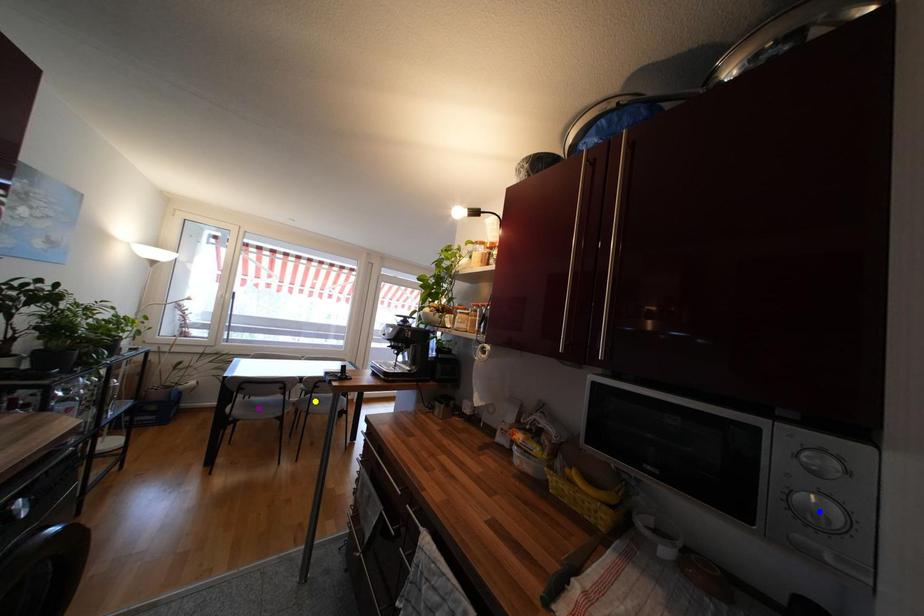
Order these from nearest to farthest:
A) purple point
B) yellow point
C) blue point

blue point
yellow point
purple point